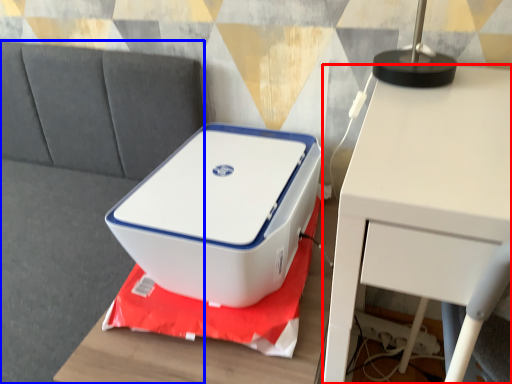
Question: Which object is further to the camera taking this photo, table (highlighted by a red box) or couch (highlighted by a blue box)?

Choices:
 (A) table
 (B) couch

Answer: (B)